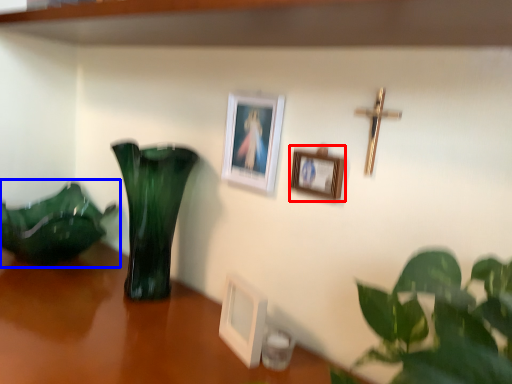
Question: Which object is further to the camera taking this photo, picture frame (highlighted by a red box) or houseplant (highlighted by a blue box)?

Choices:
 (A) picture frame
 (B) houseplant

Answer: (B)